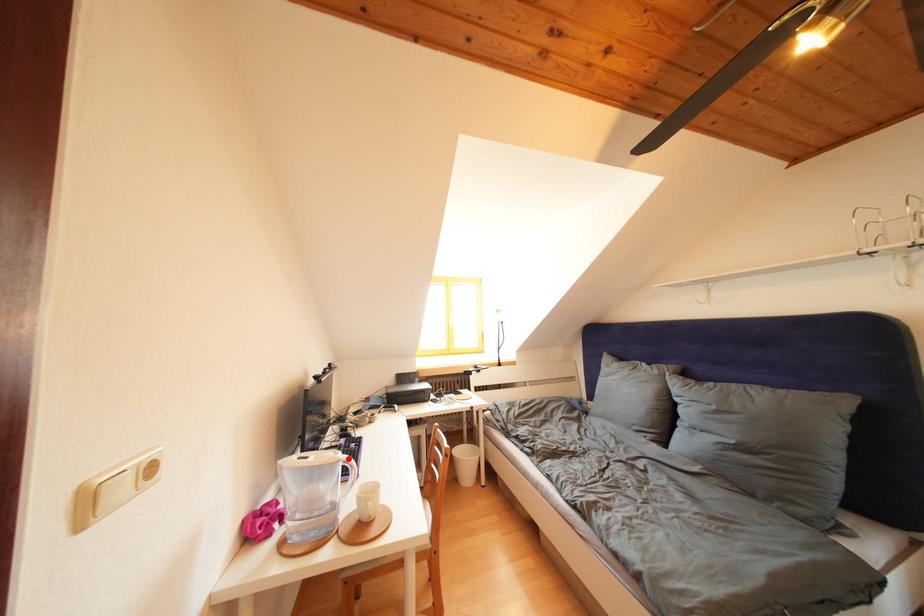
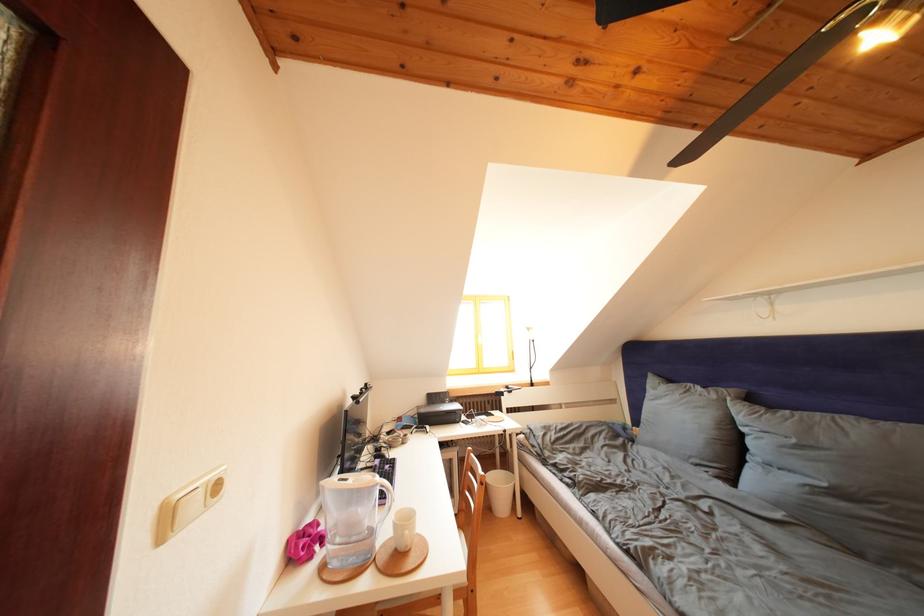
Find the pixel in the second image that matches the highlighted location in the first image.

(385, 482)